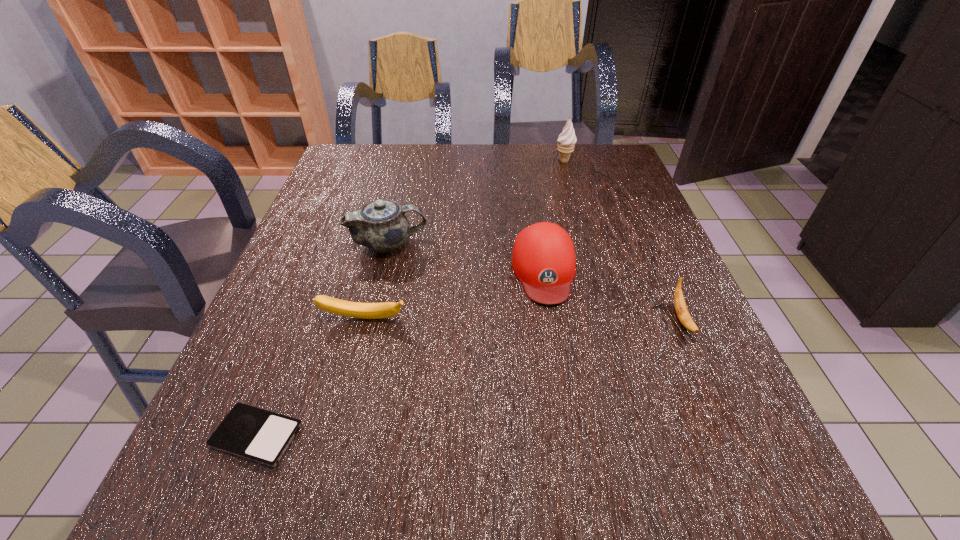
This screenshot has height=540, width=960. In order to click on vacant space located on the front-facing side of the fifth object from left to right in this screenshot , I will do `click(499, 161)`.

Identify the location of free space located 0.210m on the front-facing side of the fifth object from left to right. (487, 161).

Identify the location of free region located 0.380m from the spout of the chinaware. 585,244.

This screenshot has width=960, height=540. I want to click on free location located 0.260m on the front-facing side of the fourth shortest object, so click(568, 424).

You are a GUI agent. You are given a task and a screenshot of the screen. Output one action in this format:
    pyautogui.click(x=<x>, y=<y>)
    Task: Click on the vacant space located on the peel of the right banana from the top
    This screenshot has height=540, width=960.
    Given the screenshot: What is the action you would take?
    pyautogui.click(x=731, y=431)

What are the coordinates of `vacant space situated at the stem of the left banana` in the screenshot? It's located at (343, 402).

You are a GUI agent. You are given a task and a screenshot of the screen. Output one action in this format:
    pyautogui.click(x=<x>, y=<y>)
    Task: Click on the free space located 0.230m on the right of the iPod
    The height and width of the screenshot is (540, 960).
    Given the screenshot: What is the action you would take?
    pyautogui.click(x=444, y=436)

The width and height of the screenshot is (960, 540). I want to click on object present at the far edge, so click(566, 140).

Image resolution: width=960 pixels, height=540 pixels. What are the coordinates of `object located in the near edge section of the desktop` in the screenshot? It's located at (262, 436).

Locate an element on the screen. Image resolution: width=960 pixels, height=540 pixels. chinaware located in the left edge section of the desktop is located at coordinates (380, 225).